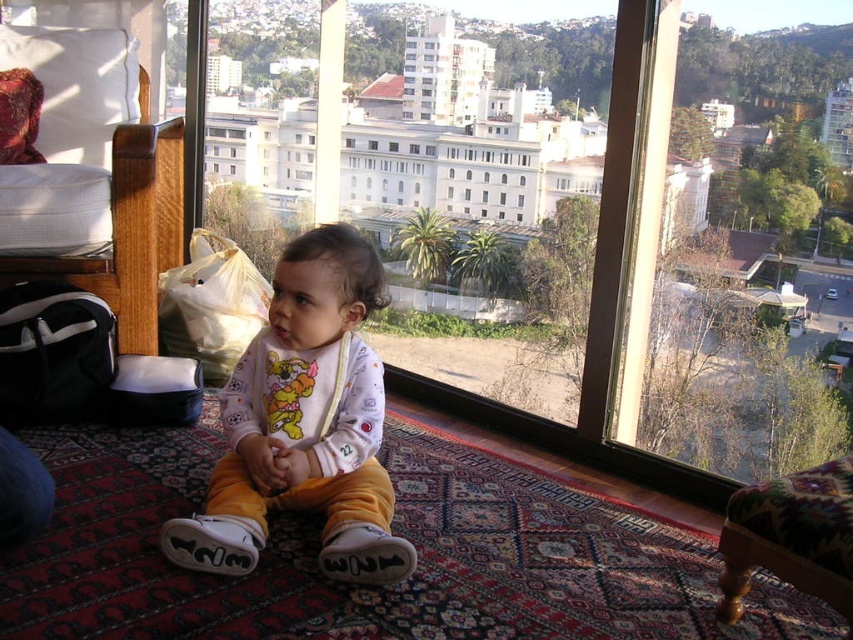
Question: Estimate the real-world distances between objects in this image. Which object is closer to the wooden armchair at lower right?

Choices:
 (A) white cotton bib at center
 (B) transparent glass door at center

Answer: (A)

Question: Can you confirm if transparent glass door at center is positioned to the right of white cotton bib at center?

Choices:
 (A) no
 (B) yes

Answer: (B)

Question: Which of these objects is positioned farthest from the wooden armchair at lower right?

Choices:
 (A) white cotton bib at center
 (B) transparent glass door at center

Answer: (B)

Question: Is transparent glass door at center to the right of wooden armchair at lower right from the viewer's perspective?

Choices:
 (A) yes
 (B) no

Answer: (B)

Question: Which point is farther to the camera?

Choices:
 (A) white cotton bib at center
 (B) transparent glass door at center

Answer: (B)

Question: Can you confirm if white cotton bib at center is positioned to the left of wooden armchair at lower right?

Choices:
 (A) yes
 (B) no

Answer: (A)